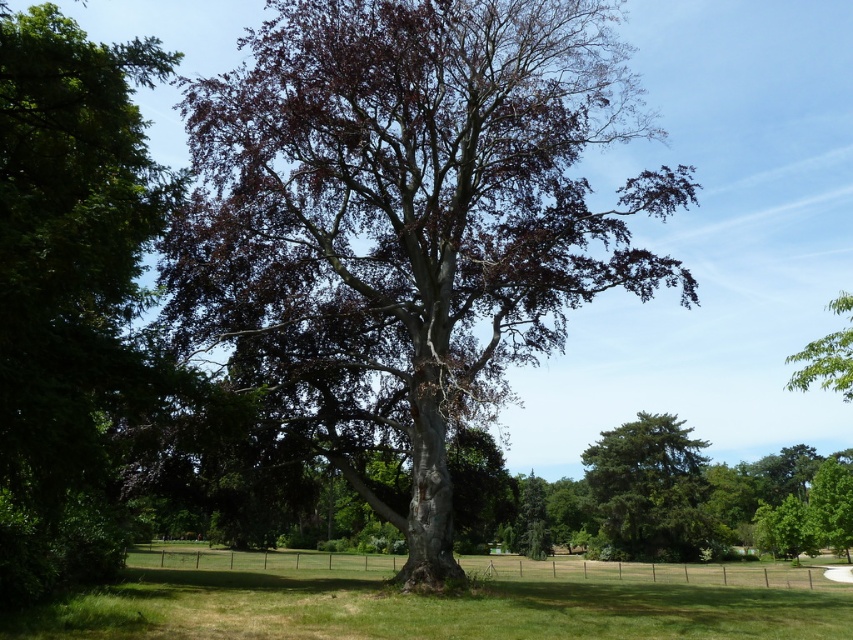
Does green grass at lower center appear on the left side of green leafy tree at upper right?

Correct, you'll find green grass at lower center to the left of green leafy tree at upper right.

Can you confirm if green grass at lower center is shorter than green leafy tree at upper right?

In fact, green grass at lower center may be taller than green leafy tree at upper right.

Locate an element on the screen. This screenshot has width=853, height=640. green grass at lower center is located at coordinates (439, 600).

Between green textured pine tree at center and green leafy tree at upper right, which one appears on the left side from the viewer's perspective?

From the viewer's perspective, green textured pine tree at center appears more on the left side.

Does green textured pine tree at center have a lesser width compared to green leafy tree at upper right?

Correct, green textured pine tree at center's width is less than green leafy tree at upper right's.

Does point (616, 458) lie behind point (843, 296)?

Yes, point (616, 458) is behind point (843, 296).

In order to click on green textured pine tree at center in this screenshot , I will do `click(651, 490)`.

Is dark brown bark tree at center bigger than green grass at lower center?

No, dark brown bark tree at center is not bigger than green grass at lower center.

Who is more forward, (498,54) or (515,592)?

Positioned in front is point (515,592).

This screenshot has width=853, height=640. What do you see at coordinates (407, 220) in the screenshot?
I see `dark brown bark tree at center` at bounding box center [407, 220].

Find the location of `dark brown bark tree at center`. dark brown bark tree at center is located at coordinates (x=407, y=220).